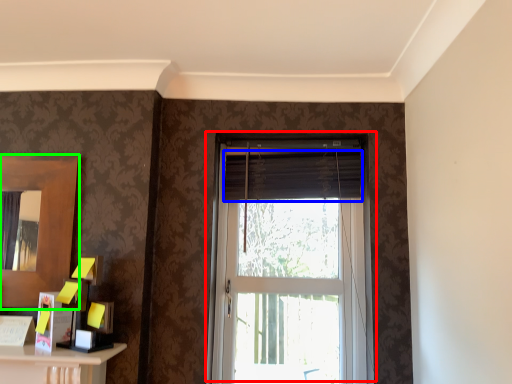
Question: Which object is positioned closest to window (highlighted by a red box)? Select from curtain (highlighted by a blue box) and mirror (highlighted by a green box).

Choices:
 (A) curtain
 (B) mirror

Answer: (A)